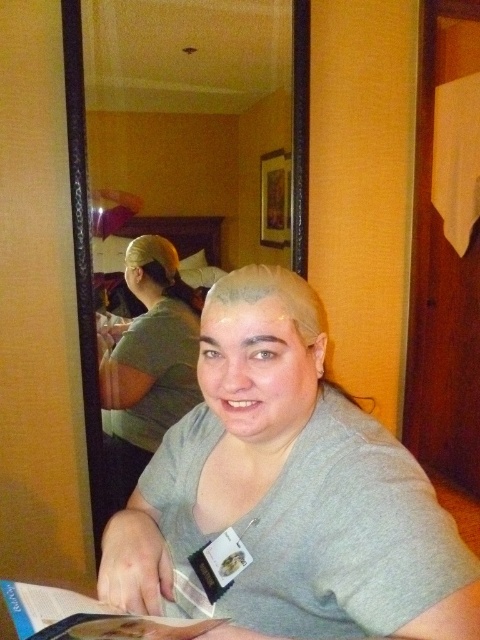
You are a photographer setting up a shot in the scene. You need to ensure that the green matte shirt at center and the matte paper magazine at lower left are both visible in the frame. Based on their sizes, which object should you focus on to include both without cropping?

The green matte shirt at center is taller than the matte paper magazine at lower left, so focusing on the taller green matte shirt at center will ensure both are visible without cropping.